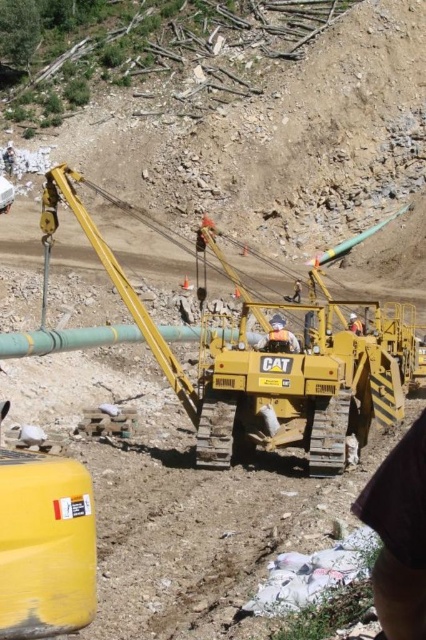
Question: Is green matte pipe at center positioned at the back of white fabric construction worker at center?

Choices:
 (A) no
 (B) yes

Answer: (A)

Question: Considering the relative positions of green matte pipe at center and white fabric construction worker at center in the image provided, where is green matte pipe at center located with respect to white fabric construction worker at center?

Choices:
 (A) right
 (B) left

Answer: (B)

Question: Is green matte pipe at center to the right of white fabric construction worker at center from the viewer's perspective?

Choices:
 (A) no
 (B) yes

Answer: (A)

Question: Among these objects, which one is nearest to the camera?

Choices:
 (A) green matte pipe at center
 (B) white fabric construction worker at center

Answer: (A)